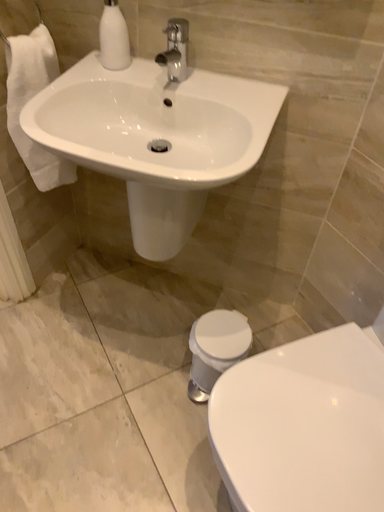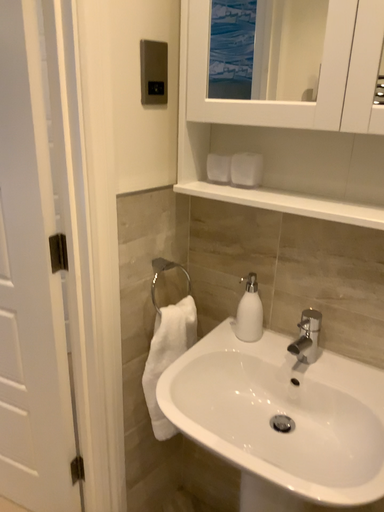
Question: Which way did the camera rotate in the video?

Choices:
 (A) rotated left
 (B) rotated right

Answer: (A)